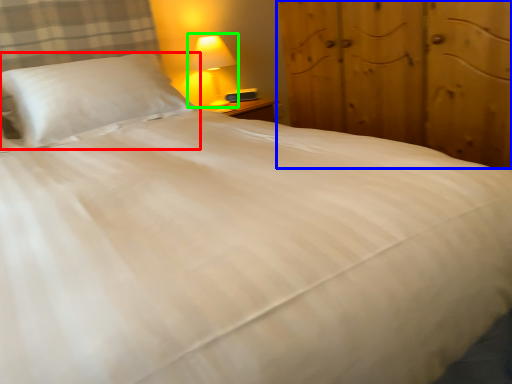
Question: Which object is the farthest from pillow (highlighted by a red box)? Choose among these: dresser (highlighted by a blue box) or lamp (highlighted by a green box).

Choices:
 (A) dresser
 (B) lamp

Answer: (A)